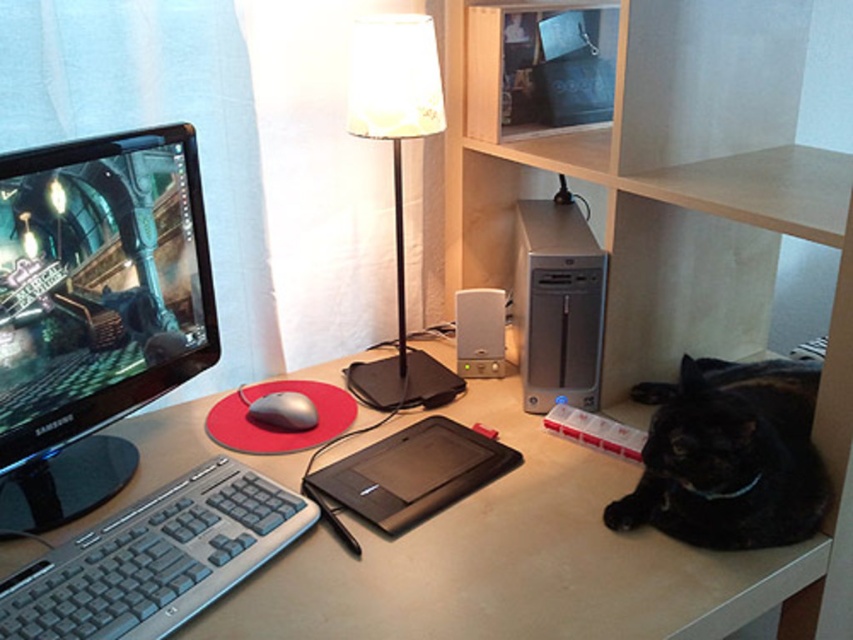
Question: Estimate the real-world distances between objects in this image. Which object is farther from the black plastic keyboard at lower left?

Choices:
 (A) matte black monitor at left
 (B) satin silver mouse at center
 (C) black matte drawing tablet at center

Answer: (B)

Question: Does black plastic keyboard at lower left appear under satin silver mouse at center?

Choices:
 (A) yes
 (B) no

Answer: (A)

Question: Where is black fur cat at lower right located in relation to black matte drawing tablet at center in the image?

Choices:
 (A) left
 (B) right

Answer: (B)

Question: Which of the following is the closest to the observer?

Choices:
 (A) matte white table at center
 (B) silver metallic desktop computer at center
 (C) matte black monitor at left

Answer: (A)

Question: Does silver metallic desktop computer at center have a larger size compared to satin silver mouse at center?

Choices:
 (A) yes
 (B) no

Answer: (A)

Question: Which object appears farthest from the camera in this image?

Choices:
 (A) white fabric lamp at center
 (B) black matte drawing tablet at center
 (C) matte black monitor at left
 (D) silver metallic desktop computer at center

Answer: (D)